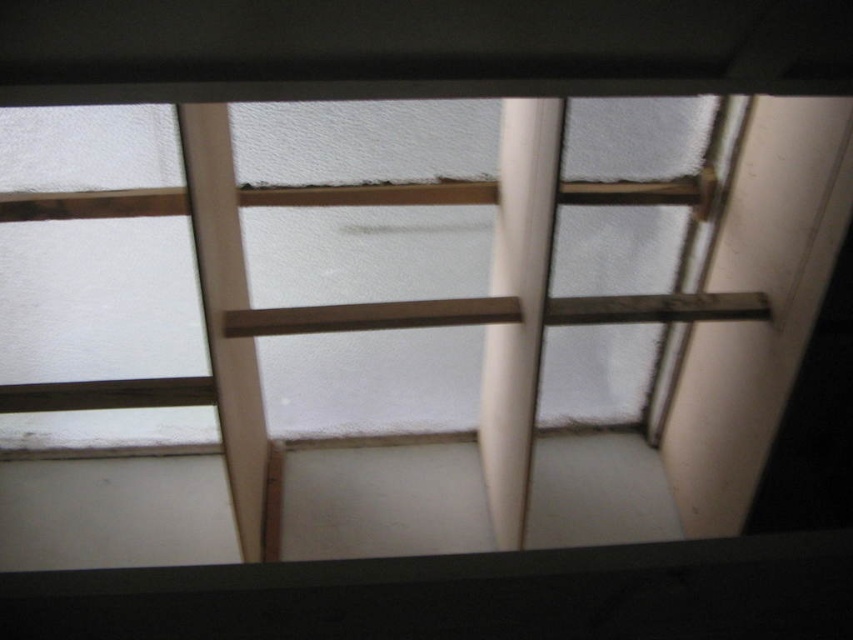
Question: Among these objects, which one is nearest to the camera?

Choices:
 (A) wooden at upper center
 (B) white smooth pole at center

Answer: (A)

Question: Can you confirm if wooden at upper center is positioned below white smooth pole at center?

Choices:
 (A) no
 (B) yes

Answer: (B)

Question: Is wooden at upper center thinner than white smooth pole at center?

Choices:
 (A) yes
 (B) no

Answer: (B)

Question: Which point is farther to the camera?

Choices:
 (A) (421, 339)
 (B) (488, 429)

Answer: (B)

Question: Does wooden at upper center appear over white smooth pole at center?

Choices:
 (A) yes
 (B) no

Answer: (B)